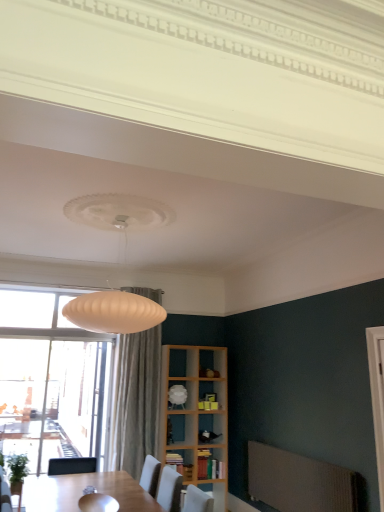
Question: Is wooden bookshelf at center located outside wooden bookshelf at lower center, positioned as the first shelf in bottom-to-top order?

Choices:
 (A) yes
 (B) no

Answer: (A)

Question: Does wooden bookshelf at center appear on the left side of wooden bookshelf at lower center, positioned as the first shelf in bottom-to-top order?

Choices:
 (A) no
 (B) yes

Answer: (A)

Question: From the image's perspective, is wooden bookshelf at center above wooden bookshelf at lower center, positioned as the first shelf in bottom-to-top order?

Choices:
 (A) no
 (B) yes

Answer: (A)

Question: Considering the relative sizes of wooden bookshelf at center and wooden bookshelf at lower center, positioned as the first shelf in bottom-to-top order, in the image provided, is wooden bookshelf at center smaller than wooden bookshelf at lower center, positioned as the first shelf in bottom-to-top order,?

Choices:
 (A) no
 (B) yes

Answer: (A)

Question: Is wooden bookshelf at center to the right of wooden bookshelf at lower center, the 2th shelf in the top-to-bottom sequence, from the viewer's perspective?

Choices:
 (A) no
 (B) yes

Answer: (B)

Question: Is point (203, 461) closer or farther from the camera than point (167, 451)?

Choices:
 (A) closer
 (B) farther

Answer: (A)

Question: Is wooden bookshelf at center situated inside wooden bookshelf at lower center, the 2th shelf in the top-to-bottom sequence, or outside?

Choices:
 (A) outside
 (B) inside

Answer: (A)

Question: Looking at the image, does wooden bookshelf at center seem bigger or smaller compared to wooden bookshelf at lower center, the 2th shelf in the top-to-bottom sequence?

Choices:
 (A) small
 (B) big

Answer: (B)

Question: From a real-world perspective, relative to wooden bookshelf at lower center, positioned as the first shelf in bottom-to-top order, is wooden bookshelf at center vertically above or below?

Choices:
 (A) above
 (B) below

Answer: (A)

Question: Relative to wooden bookshelf at center, is wooden bookshelf at lower center, positioned as the first shelf in bottom-to-top order, in front or behind?

Choices:
 (A) front
 (B) behind

Answer: (A)

Question: Considering the positions of wooden bookshelf at lower center, positioned as the first shelf in bottom-to-top order, and wooden bookshelf at center in the image, is wooden bookshelf at lower center, positioned as the first shelf in bottom-to-top order, wider or thinner than wooden bookshelf at center?

Choices:
 (A) thin
 (B) wide

Answer: (A)

Question: Is wooden bookshelf at lower center, the 2th shelf in the top-to-bottom sequence, spatially inside wooden bookshelf at center, or outside of it?

Choices:
 (A) outside
 (B) inside

Answer: (A)

Question: Is wooden bookshelf at lower center, positioned as the first shelf in bottom-to-top order, taller or shorter than wooden bookshelf at center?

Choices:
 (A) tall
 (B) short

Answer: (B)

Question: From a real-world perspective, is wooden bookshelf at lower center, the 2th shelf in the top-to-bottom sequence, physically located above or below white glossy shelf at center, the 2th shelf in the bottom-to-top sequence?

Choices:
 (A) above
 (B) below

Answer: (B)

Question: From the image's perspective, is wooden bookshelf at lower center, the 2th shelf in the top-to-bottom sequence, positioned above or below white glossy shelf at center, the 2th shelf in the bottom-to-top sequence?

Choices:
 (A) below
 (B) above

Answer: (A)